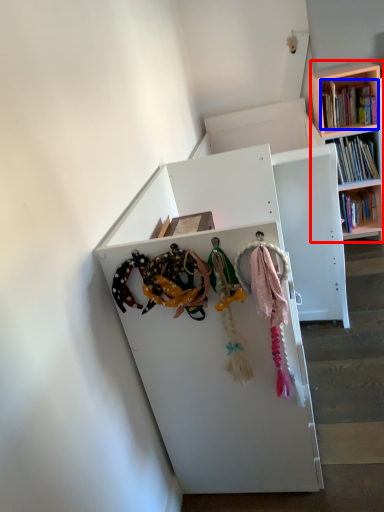
Question: Which of the following is the farthest to the observer, bookcase (highlighted by a red box) or book (highlighted by a blue box)?

Choices:
 (A) bookcase
 (B) book

Answer: (B)